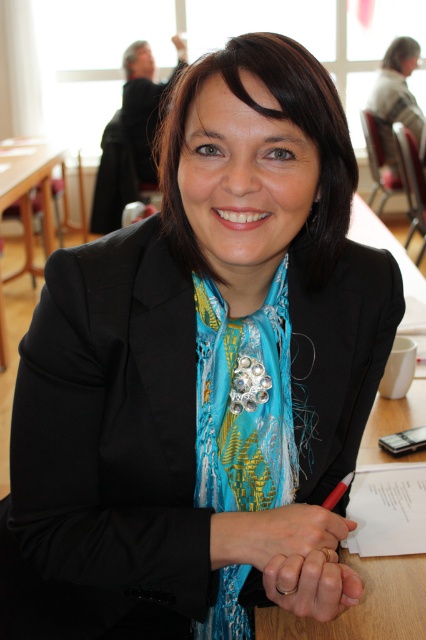
You are a person who needs to reach the metallic red pen at center from the wooden table at left. Can you walk directly to the pen without moving any furniture?

The distance between the wooden table at left and the metallic red pen at center is 3.40 meters. Since there is no mention of any furniture blocking the path, you can walk directly to the pen.

You are organizing a meeting and need to place a metallic red pen at center on the wooden table at left. Can you fit the pen on the table?

The wooden table at left is larger in size than the metallic red pen at center, so yes, the pen can fit on the table.